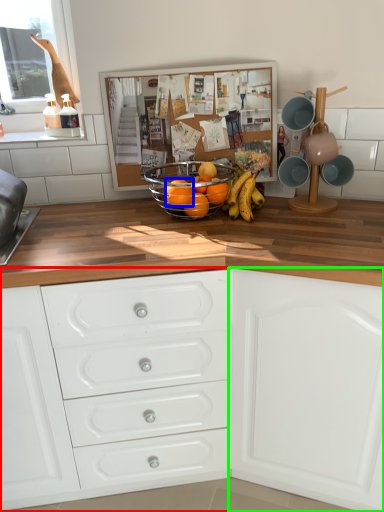
Question: Which object is positioned closest to chest of drawers (highlighted by a red box)? Select from orange (highlighted by a blue box) and cabinetry (highlighted by a green box).

Choices:
 (A) orange
 (B) cabinetry

Answer: (B)